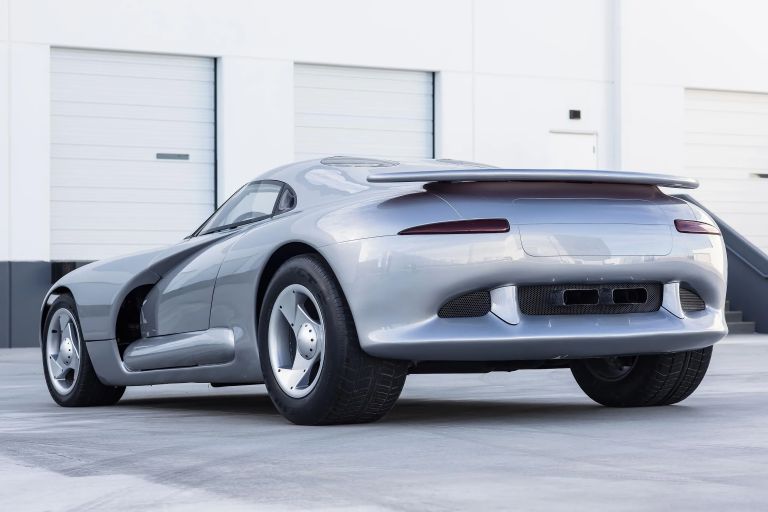
Image resolution: width=768 pixels, height=512 pixels. I want to click on concrete floor, so click(x=197, y=462), click(x=398, y=494), click(x=680, y=463).